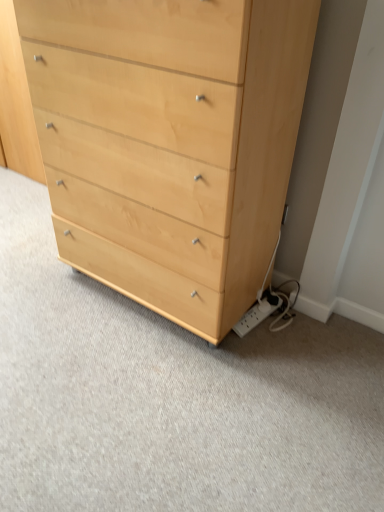
The image size is (384, 512). Find the location of `free space in front of light wood chest of drawers at center`. free space in front of light wood chest of drawers at center is located at coordinates (149, 397).